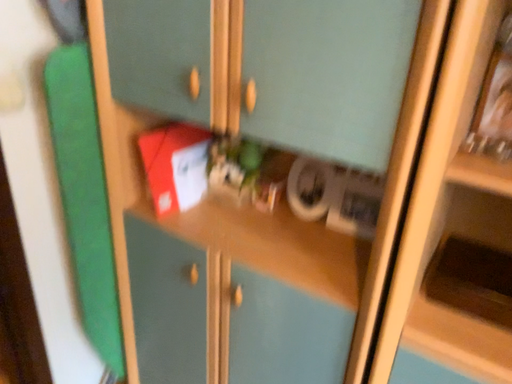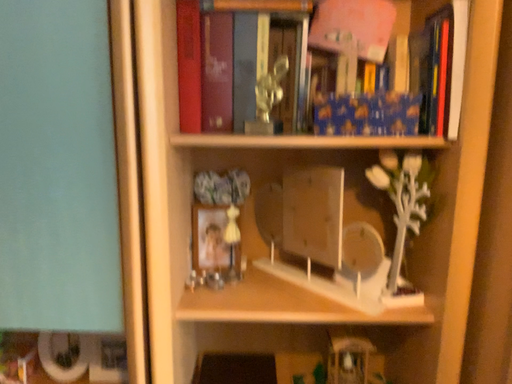
Question: How did the camera likely rotate when shooting the video?

Choices:
 (A) rotated right
 (B) rotated left

Answer: (A)